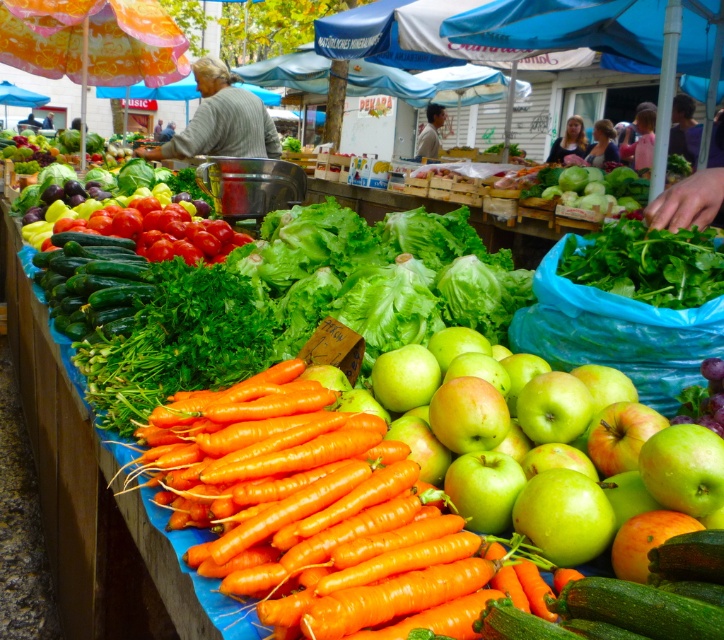
Based on the photo, you are a customer at the market stall and want to buy the green matte apple at center and the green leafy at center. Which of the two items is taller?

The green matte apple at center is much taller than the green leafy at center.

You are a customer at the market stall and want to pick up the orange smooth carrots at center and the green leafy at center. Which one is easier to reach without moving your current position?

The orange smooth carrots at center is easier to reach because it is located below the green leafy at center, meaning it is closer to you.

You are a customer at the market stall and want to buy both the orange smooth carrots at center and the green leafy at center. Which one is taller?

The orange smooth carrots at center is taller than the green leafy at center.